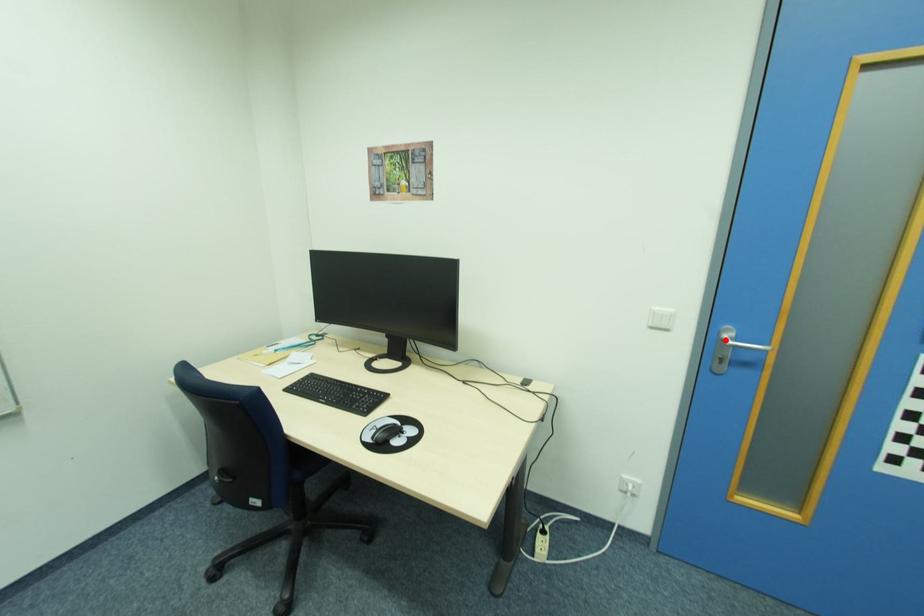
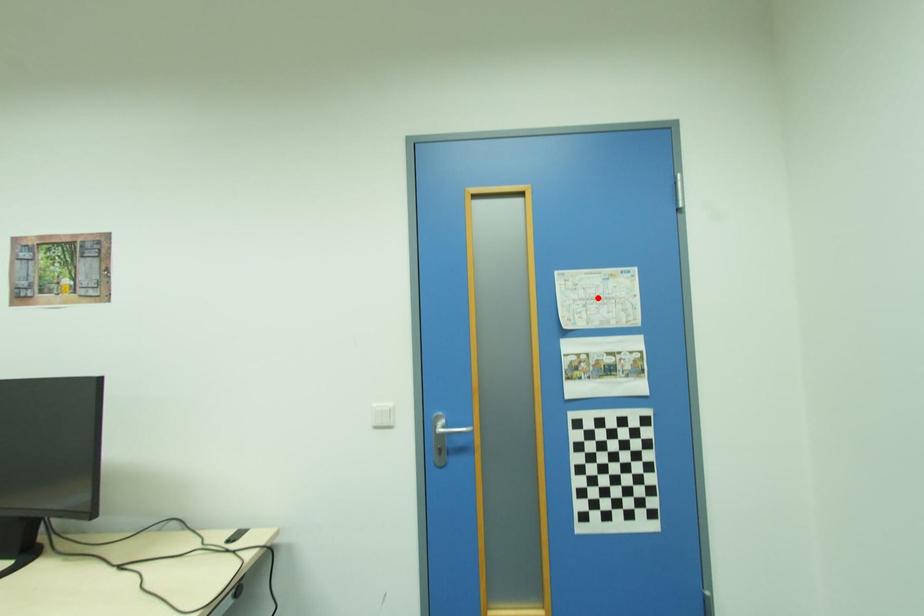
I am providing you with two images of the same scene from different viewpoints. A red point is marked on the first image and another point is marked on the second image. Is the marked point in image1 the same physical position as the marked point in image2?

No